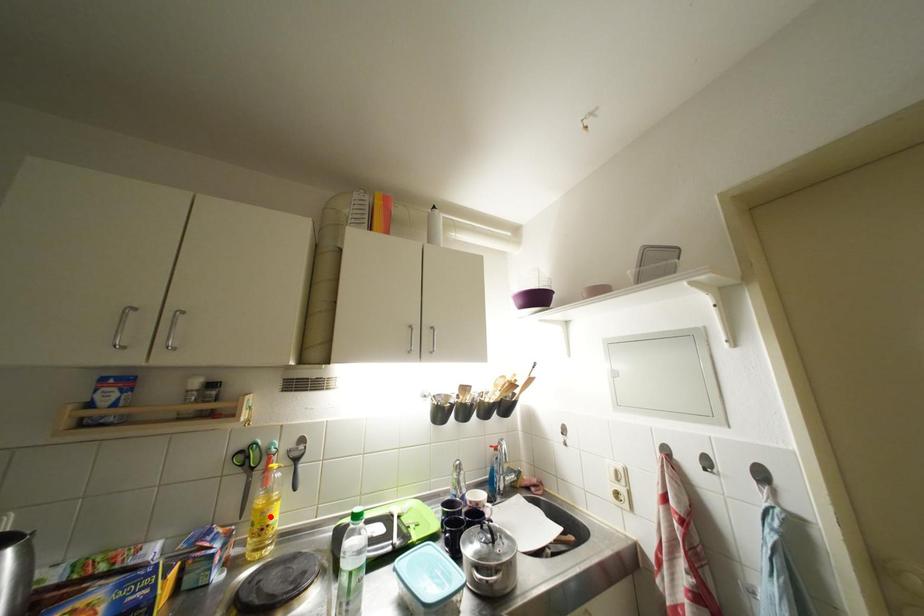
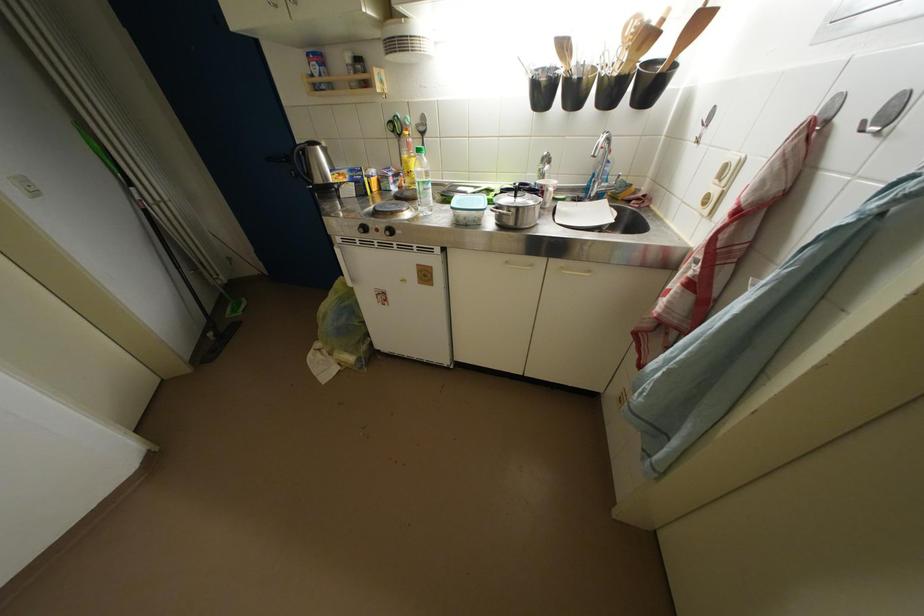
In the second image, find the point that corresponds to the highlighted location in the first image.

(412, 167)